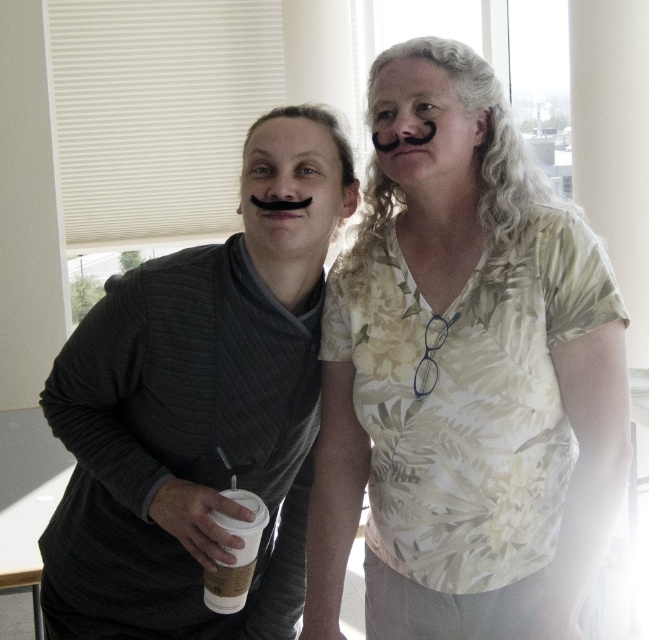
You are a photographer trying to capture both mustaches in a single shot. Since the black matte mustache at center and the black matte mustache at upper center are at different distances, which mustache will appear larger in your photo?

The black matte mustache at center will appear larger because it is closer to the viewer compared to the black matte mustache at upper center.

You are a photographer standing 1.6 meters away from the camera. You want to take a closeup shot of the black matte mustache at center. Is the current distance sufficient for a clear closeup?

The black matte mustache at center is 1.59 meters away from the camera, which is just under your current distance of 1.6 meters. This slight proximity should allow for a clear closeup shot as long as the camera has a focus capability within that range.